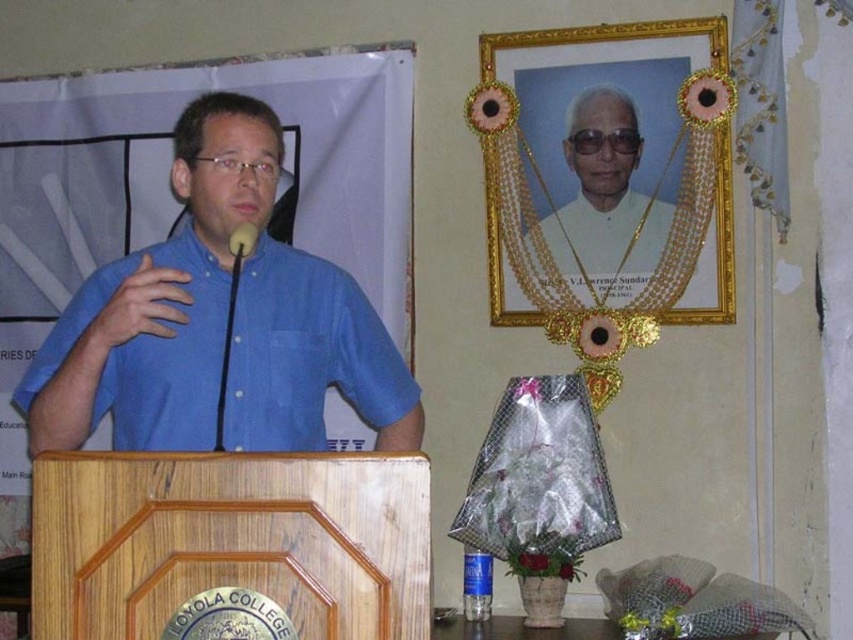
Question: Does gold/golden picture frame at upper center have a smaller size compared to matte black microphone at center?

Choices:
 (A) yes
 (B) no

Answer: (B)

Question: Can you confirm if matte blue shirt at left is bigger than gold/golden picture frame at upper center?

Choices:
 (A) yes
 (B) no

Answer: (A)

Question: Is matte blue shirt at left in front of matte black microphone at center?

Choices:
 (A) no
 (B) yes

Answer: (B)

Question: Based on their relative distances, which object is farther from the white clothed man at upper right?

Choices:
 (A) matte black microphone at center
 (B) matte blue shirt at left

Answer: (A)

Question: Among these objects, which one is nearest to the camera?

Choices:
 (A) matte black microphone at center
 (B) white clothed man at upper right

Answer: (A)

Question: Which of the following is the closest to the observer?

Choices:
 (A) gold/golden picture frame at upper center
 (B) white clothed man at upper right

Answer: (A)